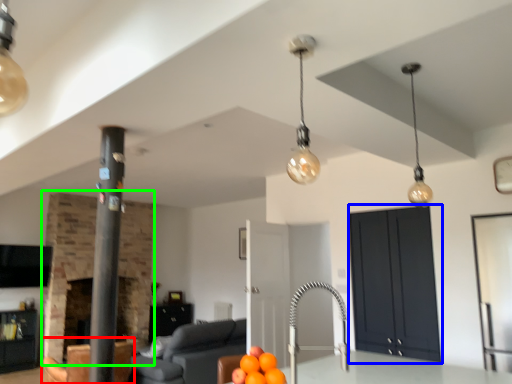
Question: Considering the real-world distances, which object is closest to armchair (highlighted by a red box)? cabinetry (highlighted by a blue box) or fireplace (highlighted by a green box).

Choices:
 (A) cabinetry
 (B) fireplace

Answer: (B)